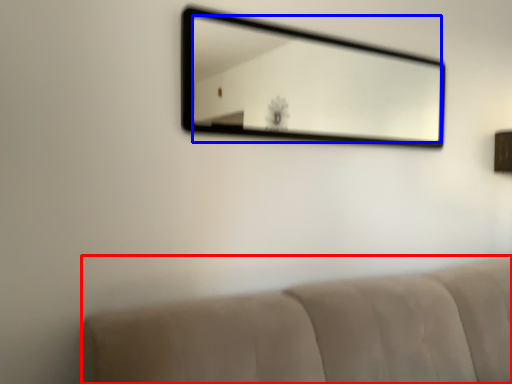
Question: Among these objects, which one is farthest to the camera, furniture (highlighted by a red box) or mirror (highlighted by a blue box)?

Choices:
 (A) furniture
 (B) mirror

Answer: (B)